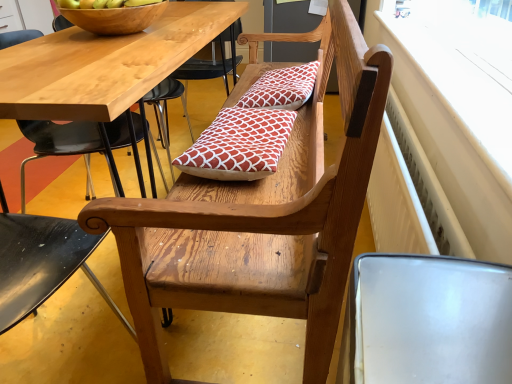
Question: Is wooden chair at left spatially inside white plastic radiator at upper right, or outside of it?

Choices:
 (A) inside
 (B) outside

Answer: (B)

Question: Considering the positions of wooden chair at left and white plastic radiator at upper right in the image, is wooden chair at left wider or thinner than white plastic radiator at upper right?

Choices:
 (A) thin
 (B) wide

Answer: (B)

Question: Based on their relative distances, which object is nearer to the red printed cushion at center, which is the 1th pillow from front to back?

Choices:
 (A) white plastic radiator at upper right
 (B) wooden bowl at upper left
 (C) wooden bench at center
 (D) red printed cushion at center, which appears as the first pillow when viewed from the top
 (E) wooden chair at left

Answer: (D)

Question: Which of these objects is positioned farthest from the white plastic radiator at upper right?

Choices:
 (A) red printed cushion at center, positioned as the 2th pillow in front-to-back order
 (B) wooden bench at center
 (C) red printed cushion at center, which is counted as the 2th pillow, starting from the top
 (D) wooden chair at left
 (E) wooden bowl at upper left

Answer: (D)